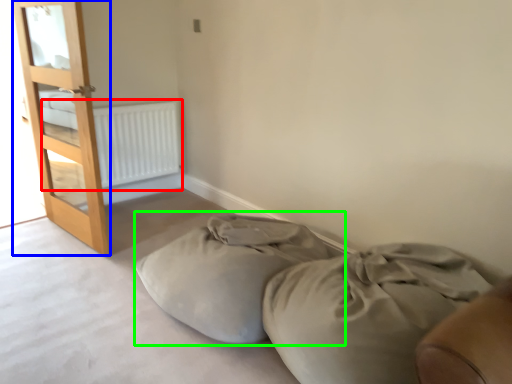
Question: Which object is positioned closest to radiator (highlighted by a red box)? Select from door (highlighted by a blue box) and bean bag chair (highlighted by a green box).

Choices:
 (A) door
 (B) bean bag chair

Answer: (A)